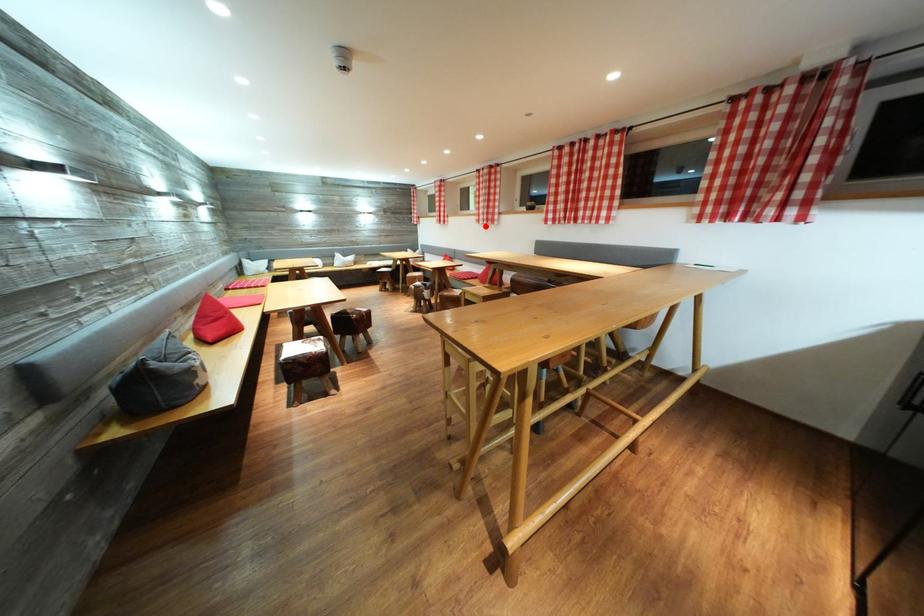
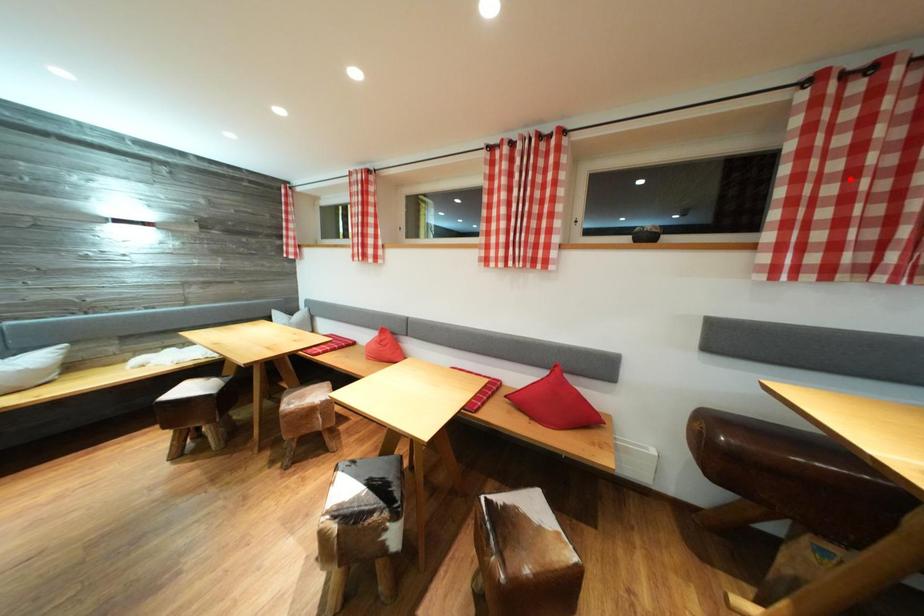
I am providing you with two images of the same scene from different viewpoints. A red point is marked on the first image and another point is marked on the second image. Are the points marked in image1 and image2 representing the same 3D position?

No